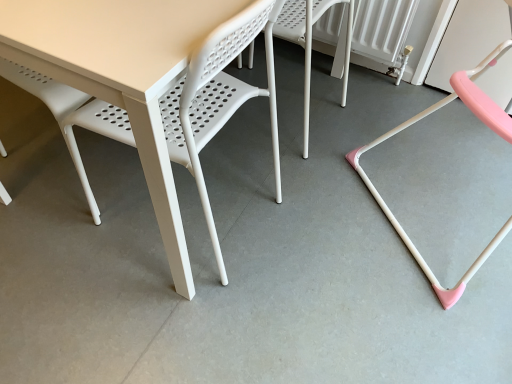
Question: Is white plastic table at center spatially inside pink plastic chair at right, the first chair when ordered from right to left, or outside of it?

Choices:
 (A) outside
 (B) inside

Answer: (A)

Question: Is point [139, 14] positioned closer to the camera than point [458, 91]?

Choices:
 (A) farther
 (B) closer

Answer: (B)

Question: Which is nearer to the white plastic chair at center, the second chair viewed from the right?

Choices:
 (A) white plastic table at center
 (B) pink plastic chair at right, which is counted as the second chair, starting from the left

Answer: (B)

Question: Which object is positioned closest to the white plastic table at center?

Choices:
 (A) white plastic chair at center, the 1th chair when ordered from left to right
 (B) pink plastic chair at right, the first chair when ordered from right to left

Answer: (A)